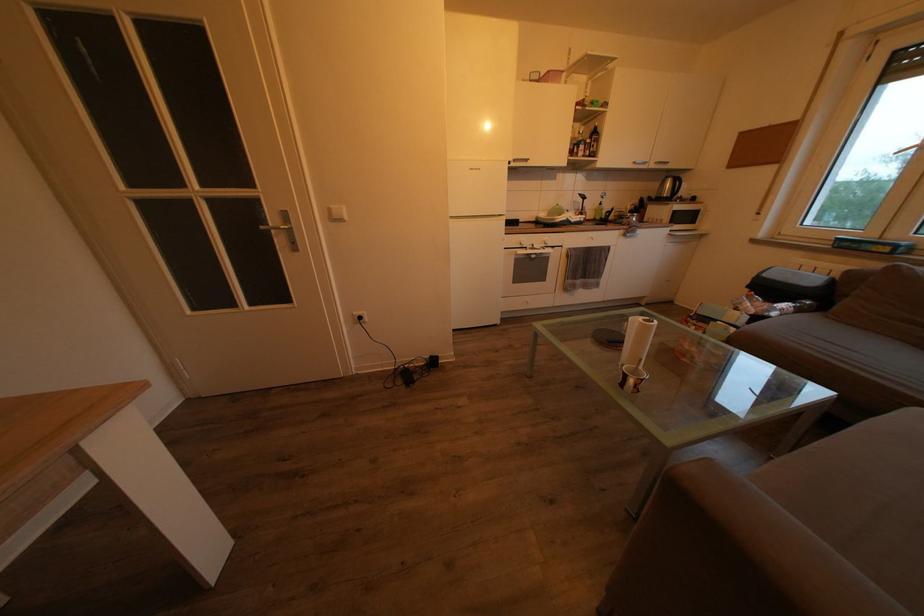
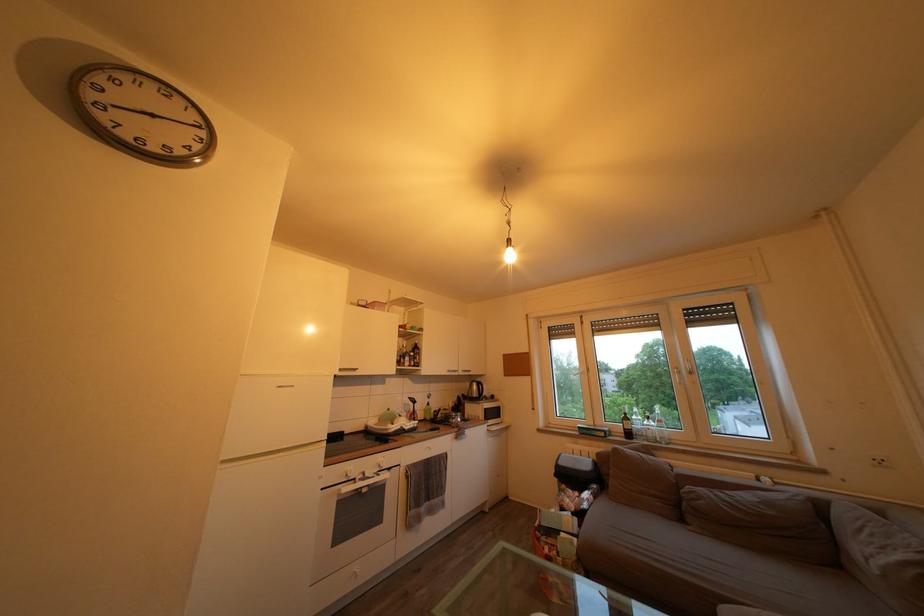
The point at (676, 191) is marked in the first image. Where is the corresponding point in the second image?

(482, 392)